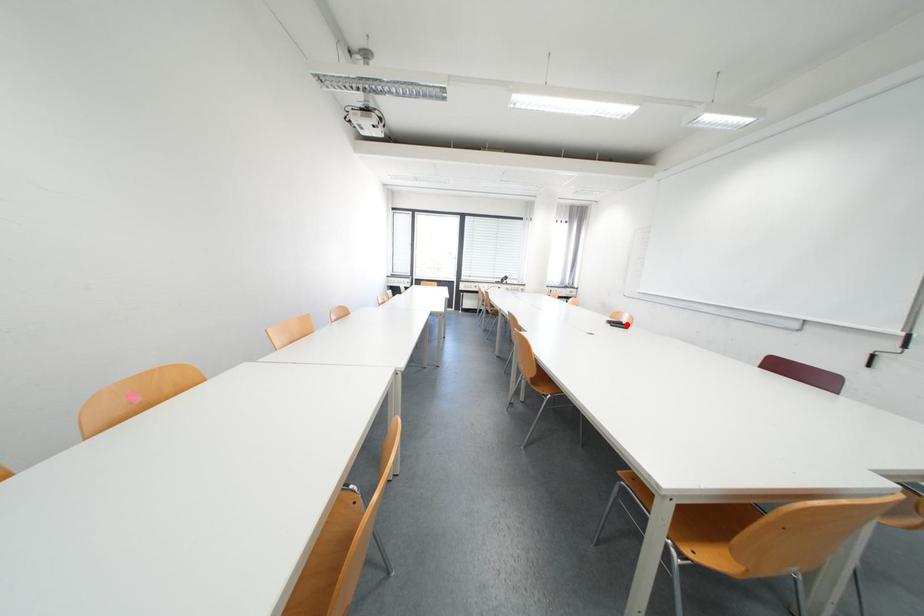
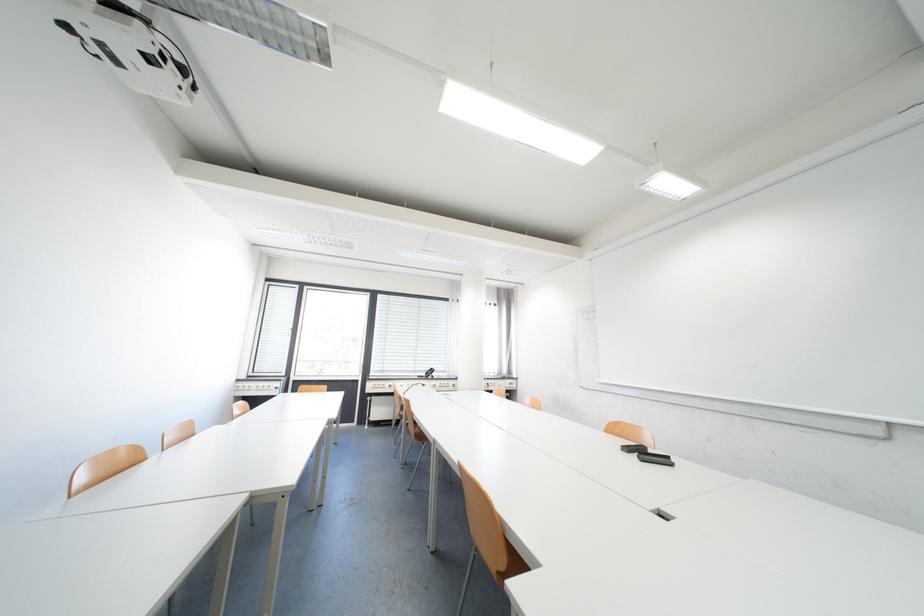
In the second image, find the point that corresponds to the highlighted location in the first image.

(652, 454)